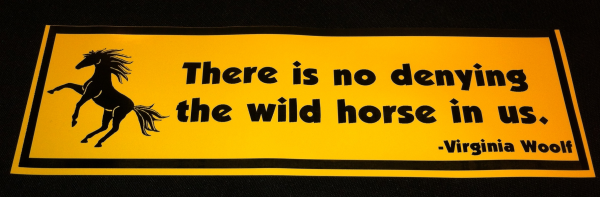
Image resolution: width=600 pixels, height=197 pixels. Identify the location of right front leg. (68, 86).